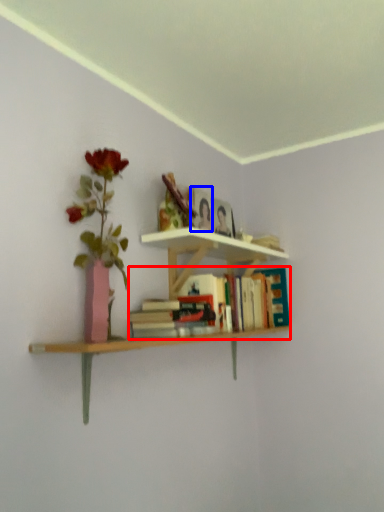
Question: Which point is closer to the camera, book (highlighted by a red box) or paperback book (highlighted by a blue box)?

Choices:
 (A) book
 (B) paperback book

Answer: (A)